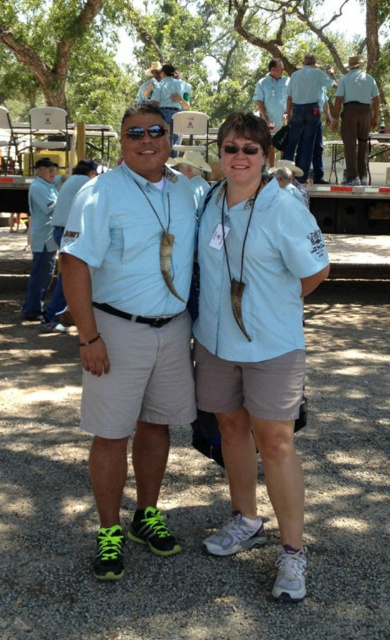
You are a photographer trying to capture a group photo of the two people in the scene. The light blue fabric shirt at center and the blue shirt at upper center are both in the frame. Based on their positions, which person should you ask to move forward slightly to ensure both are in focus?

The light blue fabric shirt at center is shorter than the blue shirt at upper center, so you should ask the person wearing the light blue fabric shirt at center to move forward slightly to align their height with the other person for better focus.

You are a photographer standing at the edge of the gathering area. You want to take a photo that includes both the neon green fabric shorts at center and the blue shirt at upper center. The camera you are using has a maximum focus range of 10 feet. Will both subjects be in focus?

The distance between the neon green fabric shorts at center and the blue shirt at upper center is 9.58 feet, which is within the camera maximum focus range of 10 feet. Therefore, both subjects will be in focus.